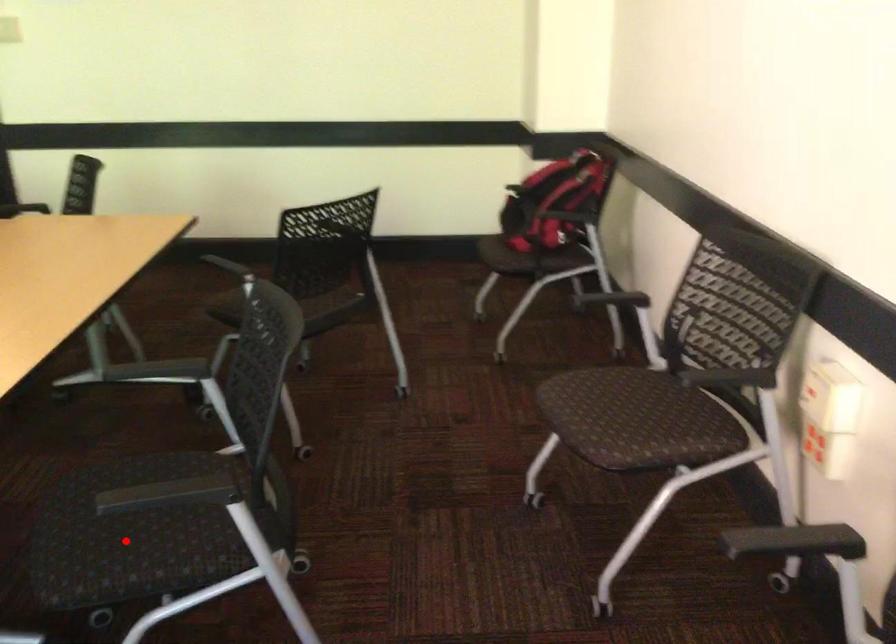
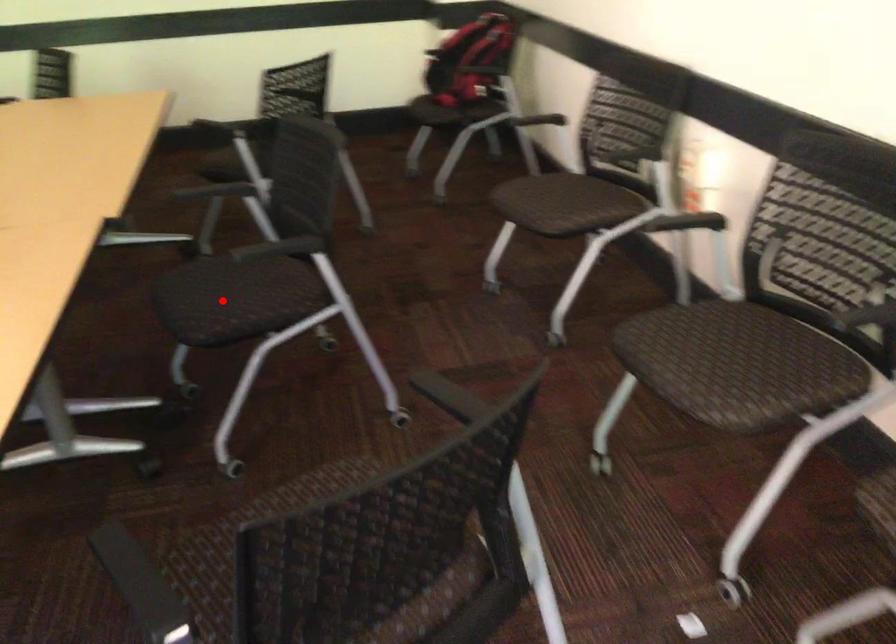
I am providing you with two images of the same scene from different viewpoints. A red point is marked on the first image and another point is marked on the second image. Is the red point in image1 aligned with the point shown in image2?

Yes